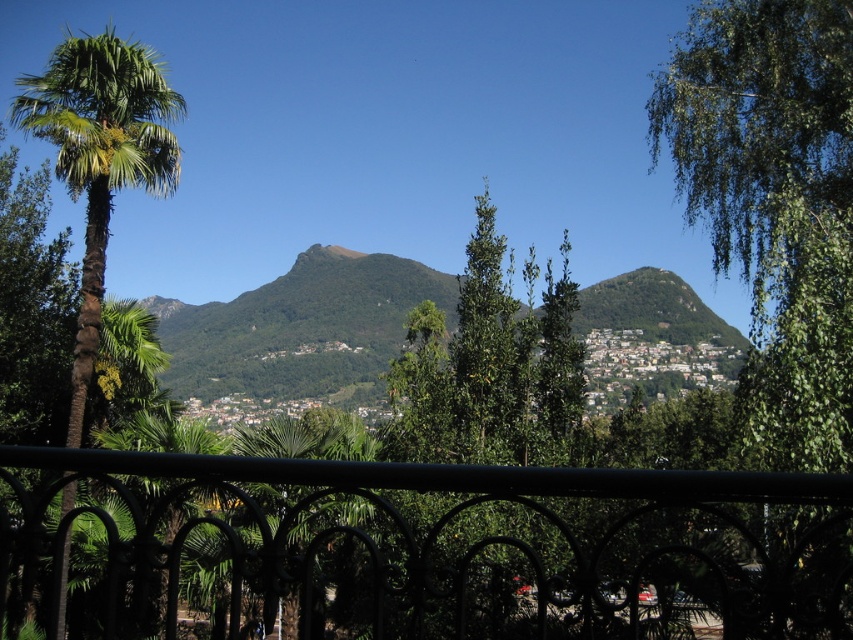
You are standing on a balcony and want to take a photo of the mountain view behind the black wrought iron fence at center. Since the fence is at a specific coordinate, will it block the mountain view in your photo?

The black wrought iron fence at center is positioned at point (421, 548), so it will block the mountain view in your photo.

You are standing on the balcony and want to take a photo of the green leafy palm tree at left without the black wrought iron fence at center blocking it. How should you position yourself?

Result: Move to the right side of the balcony so that the black wrought iron fence at center is no longer between you and the green leafy palm tree at left. Since the fence is below the palm tree, positioning yourself to the right would allow you to see the palm tree above the fence.

You are standing on the balcony and want to take a photo of both the green leafy tree at upper right and the green leafy palm tree at left. Which tree should you position closer to the camera to ensure both are in focus?

You should position the green leafy palm tree at left closer to the camera because the green leafy tree at upper right is already in front of the green leafy palm tree at left, so moving the palm tree closer would help both be in focus.